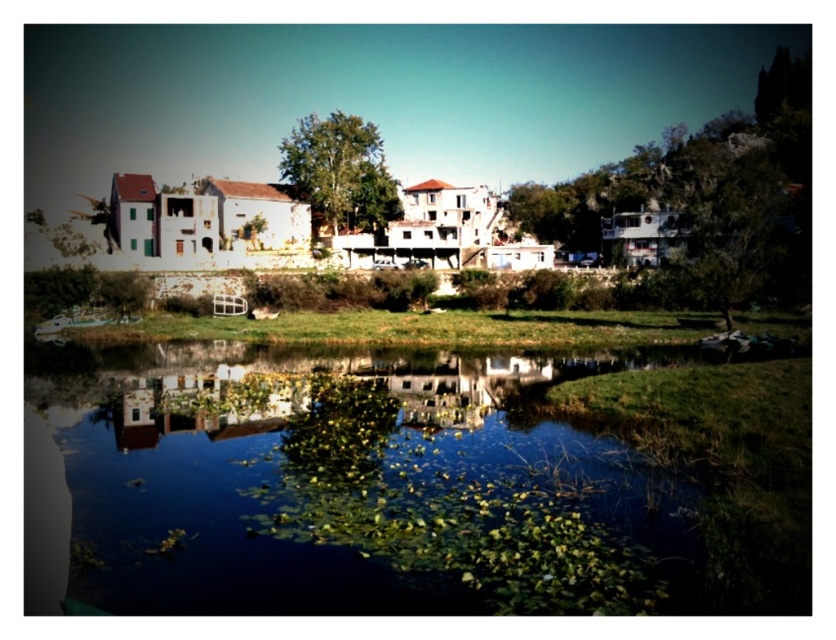
Is green leafy water at center to the left of green leafy tree at center from the viewer's perspective?

In fact, green leafy water at center is to the right of green leafy tree at center.

Which is below, green leafy water at center or green leafy tree at center?

green leafy water at center is lower down.

Locate an element on the screen. green leafy water at center is located at coordinates pos(353,484).

Where is `green leafy water at center`? This screenshot has height=640, width=836. green leafy water at center is located at coordinates (353, 484).